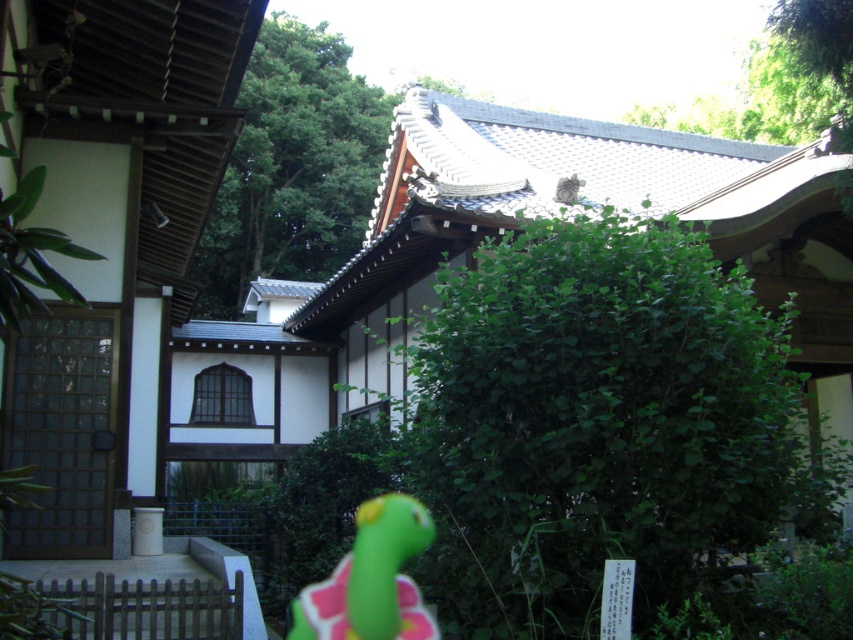
You are standing in front of the traditional Japanese building and see the green leafy tree at upper center and the green rubber toy at lower center. Which object is positioned higher in the scene?

The green leafy tree at upper center is positioned higher than the green rubber toy at lower center.

You are standing in front of the traditional Japanese building and want to take a photo of the green leafy bush at center and the green leafy tree at upper center. Which one is positioned lower in the scene?

The green leafy bush at center is positioned lower than the green leafy tree at upper center.

You are standing in front of the traditional Japanese building and notice both the green leafy tree at upper center and the gray furry cat at upper center. Which one appears bigger in the image?

The green leafy tree at upper center is larger in size compared to the gray furry cat at upper center, so the tree appears bigger.